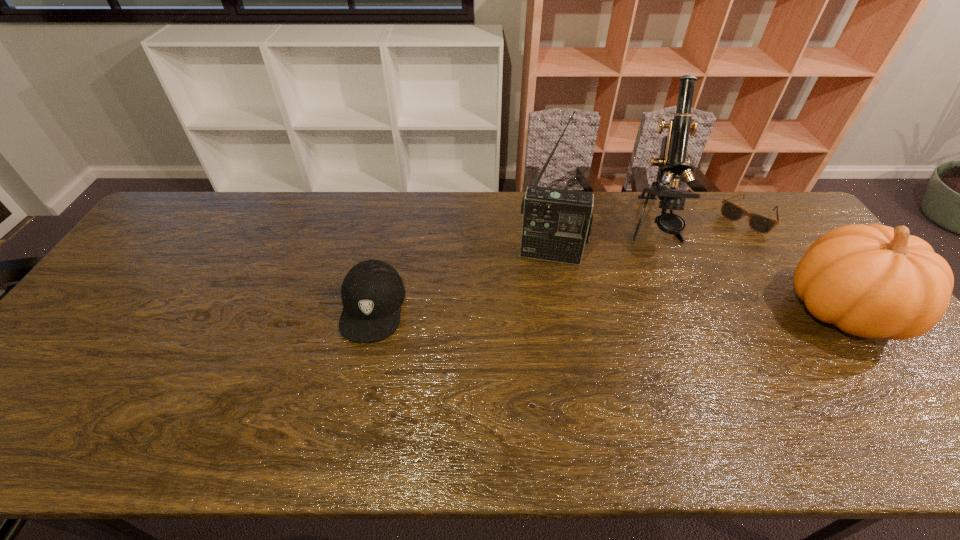
Locate an element on the screen. The height and width of the screenshot is (540, 960). blank region between the leftmost object and the third object from left to right is located at coordinates (512, 267).

I want to click on free point between the cap and the radio receiver, so click(x=462, y=280).

The width and height of the screenshot is (960, 540). Identify the location of unoccupied area between the shortest object and the third object from right to left. (700, 222).

You are a GUI agent. You are given a task and a screenshot of the screen. Output one action in this format:
    pyautogui.click(x=<x>, y=<y>)
    Task: Click on the free space between the sunglasses and the third tallest object
    The height and width of the screenshot is (540, 960).
    Given the screenshot: What is the action you would take?
    pyautogui.click(x=795, y=264)

Identify which object is the closest to the radio receiver. Please provide its 2D coordinates. Your answer should be formatted as a tuple, i.e. [(x, y)], where the tuple contains the x and y coordinates of a point satisfying the conditions above.

[(672, 162)]

At what (x,y) coordinates should I click in order to perform the action: click on object that is the nearest to the third shortest object. Please return your answer as a coordinate pair (x, y). The height and width of the screenshot is (540, 960). Looking at the image, I should click on (761, 224).

Identify the location of free space in the image that satisfies the following two spatial constraints: 1. on the front-facing side of the third shortest object; 2. on the right side of the leftmost object. (372, 310).

You are a GUI agent. You are given a task and a screenshot of the screen. Output one action in this format:
    pyautogui.click(x=<x>, y=<y>)
    Task: Click on the free space that satisfies the following two spatial constraints: 1. on the front-facing side of the third tallest object; 2. on the right side of the leftmost object
    
    Given the screenshot: What is the action you would take?
    pyautogui.click(x=372, y=310)